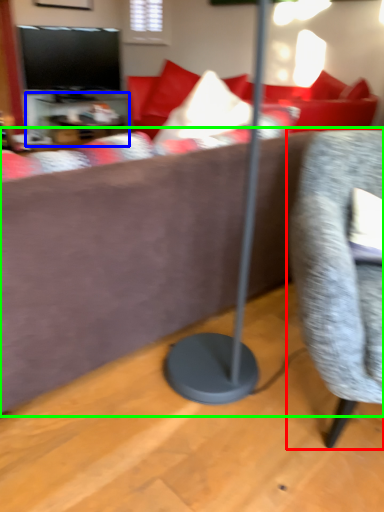
Question: Which is farther away from chair (highlighted by a red box)? table (highlighted by a blue box) or studio couch (highlighted by a green box)?

Choices:
 (A) table
 (B) studio couch

Answer: (A)